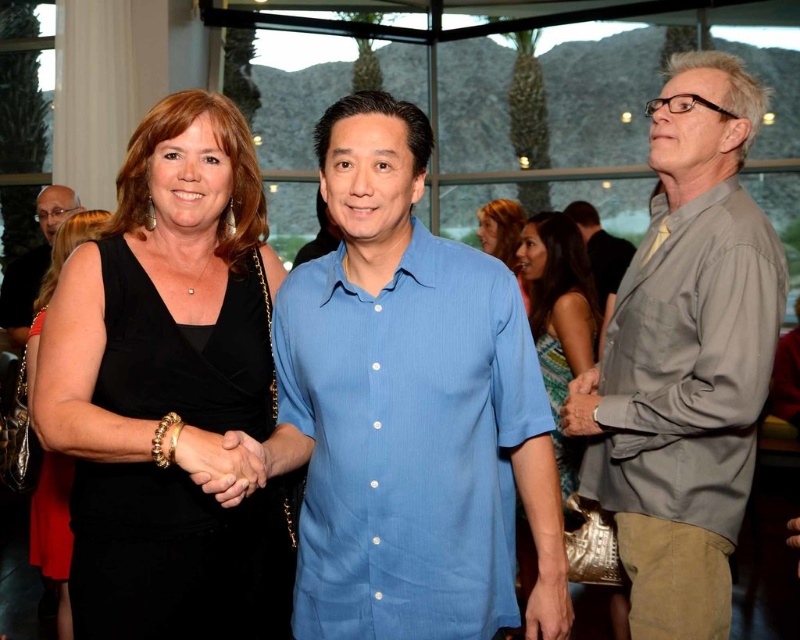
You are a photographer at the event and need to ensure that both the black velvet dress at center and the matte black glasses at upper left are visible in your shot. Given that your camera has a fixed focal length and limited field of view, which object should you prioritize framing closer to the edge of the frame to avoid cropping the other?

The matte black glasses at upper left should be placed closer to the edge of the frame because they are smaller in size compared to the black velvet dress at center, making them easier to position without obstructing the larger object.

You are a photographer at the event and need to ensure that both the matte black glasses at upper left and the matte black dress at center are clearly visible in your photo. Given their sizes, which object should you focus on first to ensure sharpness?

The matte black glasses at upper left has a smaller size compared to the matte black dress at center, so you should focus on the matte black dress at center first because it is larger and easier to capture clearly.